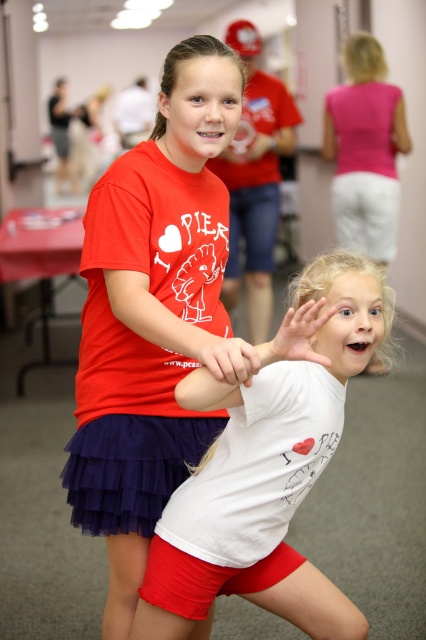
You are standing in front of the image and want to touch the two points labeled as point (336, 260) and point (201, 179). Which point would your finger reach first if you try to touch them both at the same time?

Point (336, 260) is closer to the camera than point (201, 179), so your finger would reach point (336, 260) first.